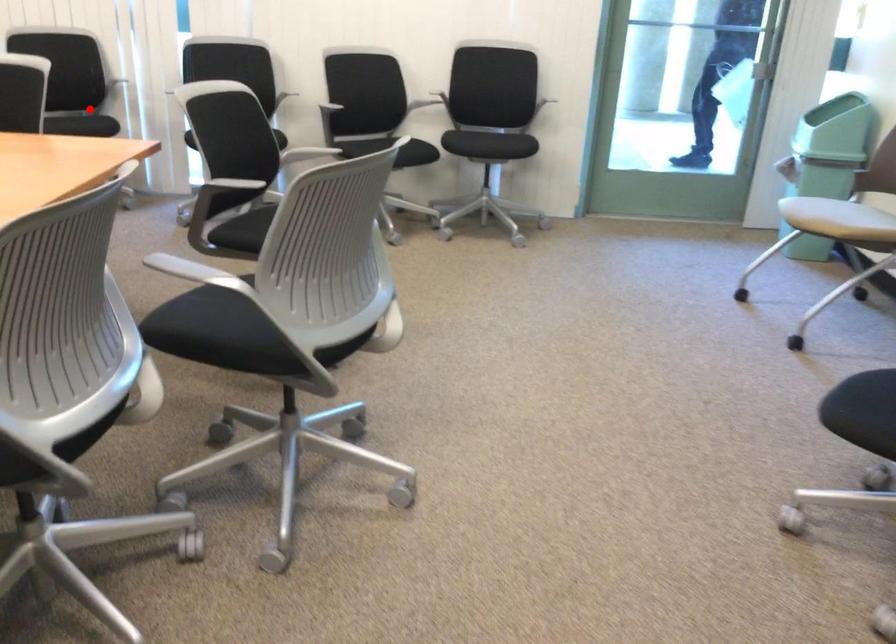
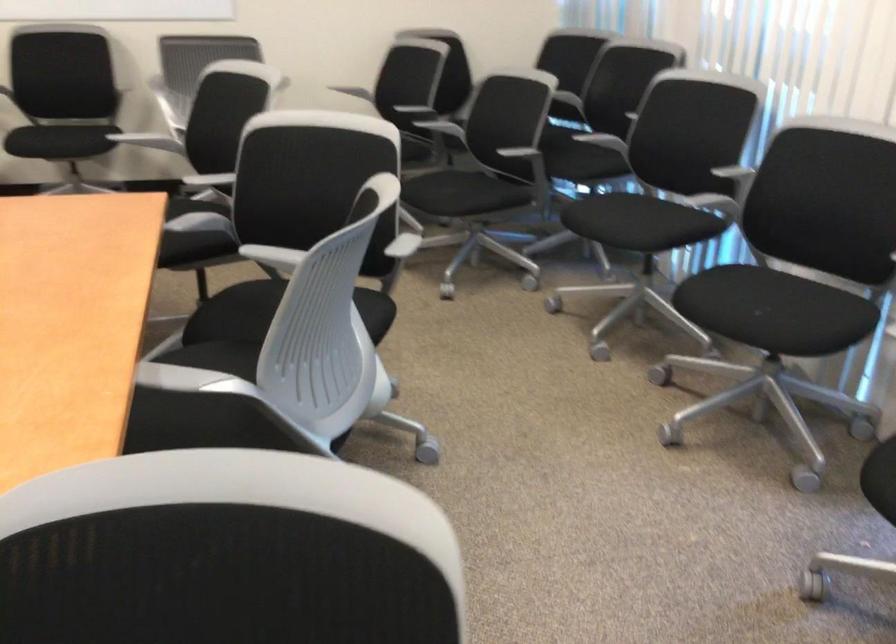
The point at the highlighted location is marked in the first image. Where is the corresponding point in the second image?

(771, 310)